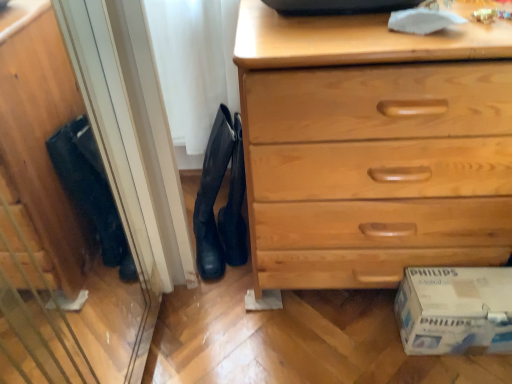
Identify the location of vacant space to the left of white cardboard box at lower right. The image size is (512, 384). (367, 336).